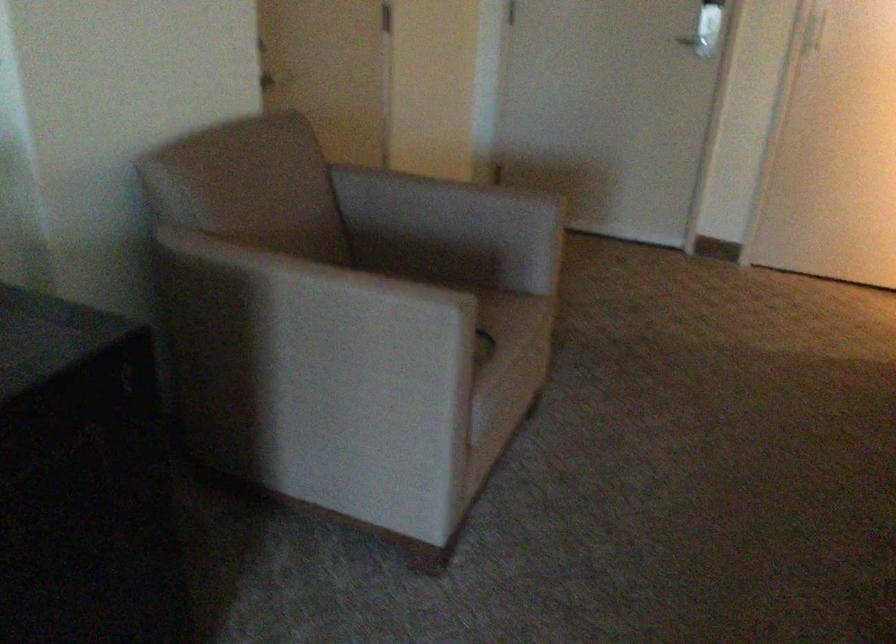
The image size is (896, 644). What are the coordinates of `metal door handle` in the screenshot? It's located at (694, 41).